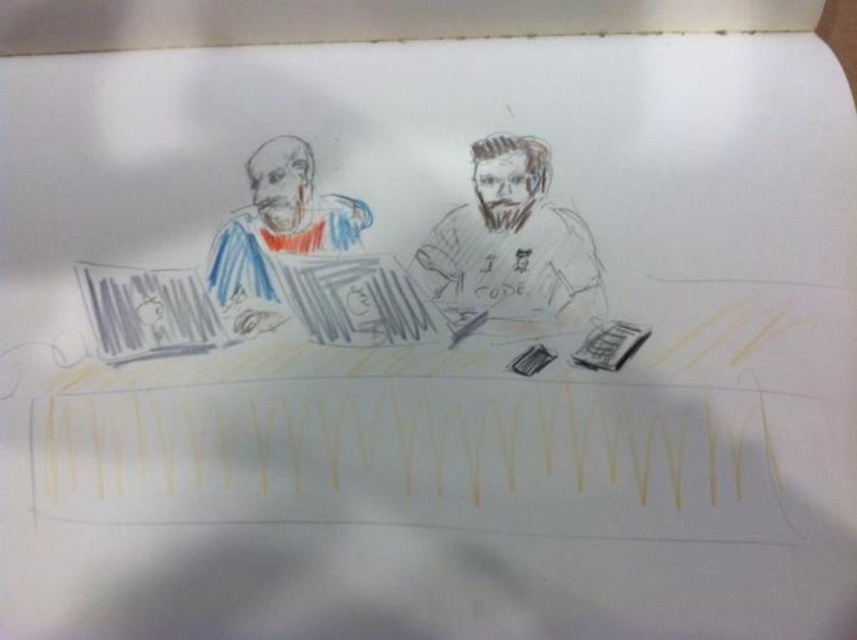
Question: Does gray pencil sketch of man at center have a larger size compared to matte blue and red striped shirt at left?

Choices:
 (A) no
 (B) yes

Answer: (B)

Question: Can you confirm if gray pencil sketch of man at center is bigger than matte blue and red striped shirt at left?

Choices:
 (A) yes
 (B) no

Answer: (A)

Question: Is gray pencil sketch of man at center closer to camera compared to matte blue and red striped shirt at left?

Choices:
 (A) no
 (B) yes

Answer: (B)

Question: Which object is farther from the camera taking this photo?

Choices:
 (A) matte blue and red striped shirt at left
 (B) gray pencil sketch of man at center

Answer: (A)